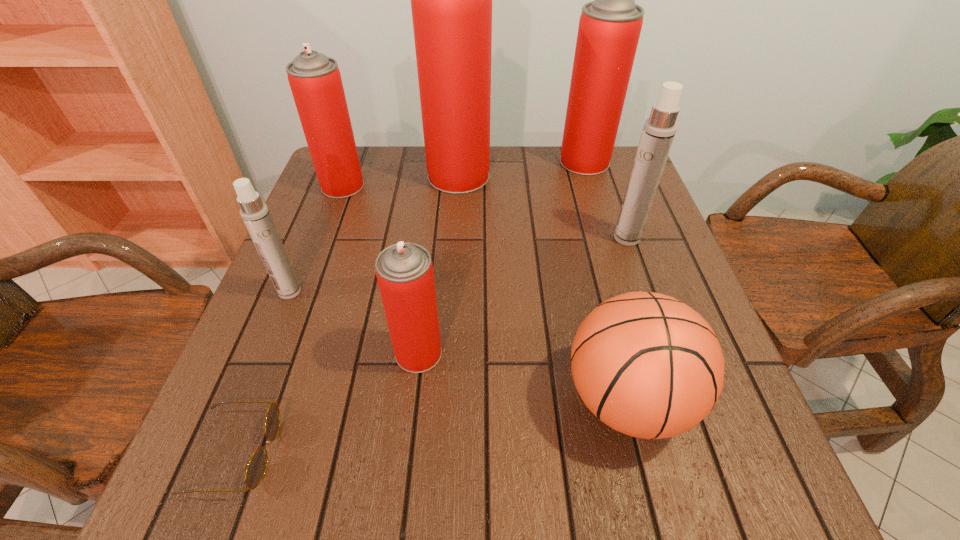
Identify the location of the fifth farthest object. (255, 214).

Locate an element on the screen. The image size is (960, 540). basketball is located at coordinates (647, 365).

The width and height of the screenshot is (960, 540). I want to click on the shortest object, so click(x=256, y=469).

The height and width of the screenshot is (540, 960). Identify the location of gray sunglasses. (256, 469).

At what (x,y) coordinates should I click in order to perform the action: click on free space located on the left of the tallest aerosol can. Please return your answer as a coordinate pair (x, y). This screenshot has width=960, height=540. Looking at the image, I should click on click(373, 176).

Identify the location of free space located on the right of the second tallest aerosol can. 627,162.

Where is `vacant space located on the right of the third biggest red aerosol can`? Image resolution: width=960 pixels, height=540 pixels. vacant space located on the right of the third biggest red aerosol can is located at coordinates (505, 186).

You are a GUI agent. You are given a task and a screenshot of the screen. Output one action in this format:
    pyautogui.click(x=<x>, y=<y>)
    Task: Click on the free region located 0.310m on the front of the fourth farthest aerosol can
    This screenshot has width=960, height=540.
    Given the screenshot: What is the action you would take?
    pyautogui.click(x=670, y=361)

Locate an element on the screen. This screenshot has width=960, height=540. vacant space located 0.150m on the right of the smallest red aerosol can is located at coordinates (523, 353).

I want to click on vacant point located 0.060m on the back of the smaller white aerosol can, so (x=301, y=264).